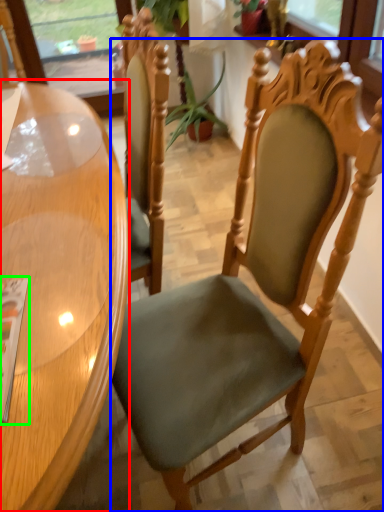
Question: Based on their relative distances, which object is farther from table (highlighted by a red box)? Choose from chair (highlighted by a blue box) and magazine (highlighted by a green box).

Choices:
 (A) chair
 (B) magazine

Answer: (A)